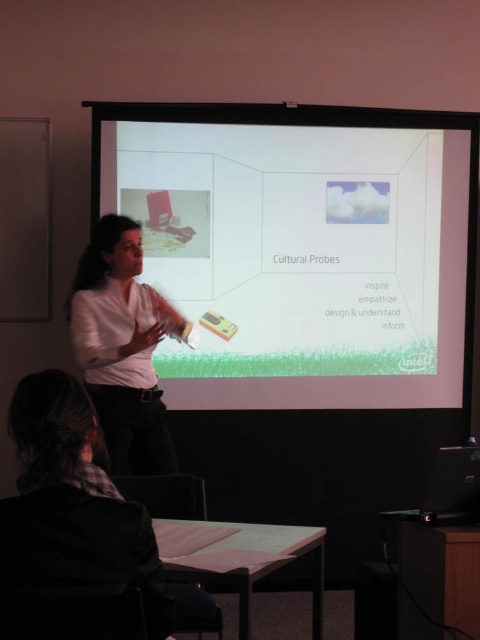
Is black fabric jacket at lower left shorter than white matte shirt at center?

Yes.

Is black fabric jacket at lower left below white matte shirt at center?

Yes.

Is point (75, 484) closer to camera compared to point (131, 292)?

Yes, it is in front of point (131, 292).

This screenshot has height=640, width=480. What are the coordinates of `black fabric jacket at lower left` in the screenshot? It's located at (82, 509).

Can you confirm if white glossy projector screen at upper center is smaller than black fabric jacket at lower left?

Actually, white glossy projector screen at upper center might be larger than black fabric jacket at lower left.

Which is below, white glossy projector screen at upper center or black fabric jacket at lower left?

black fabric jacket at lower left is below.

Image resolution: width=480 pixels, height=640 pixels. What are the coordinates of `white glossy projector screen at upper center` in the screenshot? It's located at (302, 248).

What are the coordinates of `white glossy projector screen at upper center` in the screenshot? It's located at (302, 248).

Is white glossy projector screen at upper center smaller than white matte shirt at center?

Incorrect, white glossy projector screen at upper center is not smaller in size than white matte shirt at center.

Can you confirm if white glossy projector screen at upper center is wider than white matte shirt at center?

Yes.

Is point (204, 307) farther from camera compared to point (137, 378)?

Yes, point (204, 307) is farther from viewer.

Identify the location of white glossy projector screen at upper center. (302, 248).